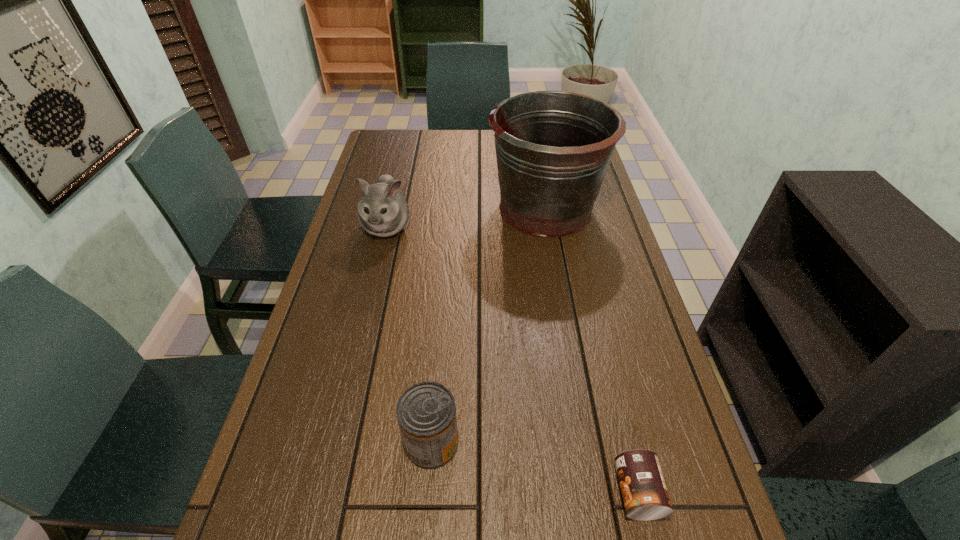
The height and width of the screenshot is (540, 960). I want to click on vacant region located on the front label of the shorter can, so click(585, 492).

Identify the location of vacant area situated on the front label of the shorter can. The height and width of the screenshot is (540, 960). [415, 492].

You are a GUI agent. You are given a task and a screenshot of the screen. Output one action in this format:
    pyautogui.click(x=<x>, y=<y>)
    Task: Click on the vacant region located on the front label of the shorter can
    
    Given the screenshot: What is the action you would take?
    pyautogui.click(x=415, y=492)

Image resolution: width=960 pixels, height=540 pixels. What are the coordinates of `object that is at the left edge` in the screenshot? It's located at (383, 211).

Find the location of a particular element. This screenshot has width=960, height=540. bucket positioned at the right edge is located at coordinates click(x=553, y=148).

What are the coordinates of `can present at the right edge` in the screenshot? It's located at (645, 496).

The height and width of the screenshot is (540, 960). I want to click on vacant space at the far edge, so click(474, 143).

In the image, there is a desktop. At what (x,y) coordinates should I click in order to perform the action: click on vacant space at the left edge. Please return your answer as a coordinate pair (x, y). The image size is (960, 540). Looking at the image, I should click on (272, 470).

Where is `vacant area at the right edge`? The image size is (960, 540). vacant area at the right edge is located at coordinates (662, 448).

At what (x,y) coordinates should I click in order to perform the action: click on blank region between the shortest object and the second tallest object. Please return your answer as a coordinate pair (x, y). The image size is (960, 540). Looking at the image, I should click on (512, 359).